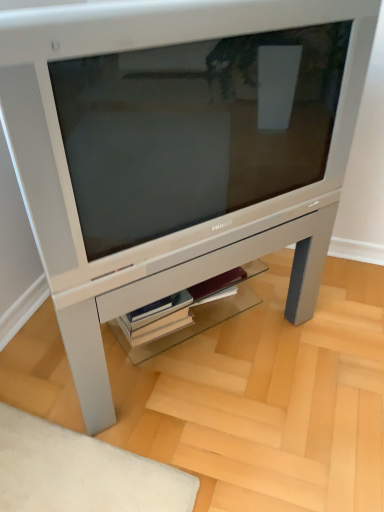
Question: From the image's perspective, is satin silver table at center located above white glossy shelf at center?

Choices:
 (A) no
 (B) yes

Answer: (B)

Question: From the image's perspective, does satin silver table at center appear lower than white glossy shelf at center?

Choices:
 (A) no
 (B) yes

Answer: (A)

Question: Would you say white glossy shelf at center is part of satin silver table at center's contents?

Choices:
 (A) no
 (B) yes

Answer: (B)

Question: From a real-world perspective, is satin silver table at center physically below white glossy shelf at center?

Choices:
 (A) no
 (B) yes

Answer: (A)

Question: From a real-world perspective, is satin silver table at center on top of white glossy shelf at center?

Choices:
 (A) yes
 (B) no

Answer: (A)

Question: Is satin silver table at center outside white glossy shelf at center?

Choices:
 (A) no
 (B) yes

Answer: (B)

Question: Is satin silver table at center at the back of satin silver monitor at center?

Choices:
 (A) no
 (B) yes

Answer: (A)

Question: Does satin silver monitor at center turn towards satin silver table at center?

Choices:
 (A) no
 (B) yes

Answer: (A)

Question: From the image's perspective, is satin silver monitor at center below satin silver table at center?

Choices:
 (A) no
 (B) yes

Answer: (A)

Question: Is satin silver monitor at center not close to satin silver table at center?

Choices:
 (A) no
 (B) yes

Answer: (A)

Question: Is the position of satin silver monitor at center less distant than that of satin silver table at center?

Choices:
 (A) yes
 (B) no

Answer: (A)

Question: Does satin silver monitor at center have a greater width compared to satin silver table at center?

Choices:
 (A) no
 (B) yes

Answer: (A)

Question: From a real-world perspective, does satin silver monitor at center sit lower than white glossy shelf at center?

Choices:
 (A) no
 (B) yes

Answer: (A)